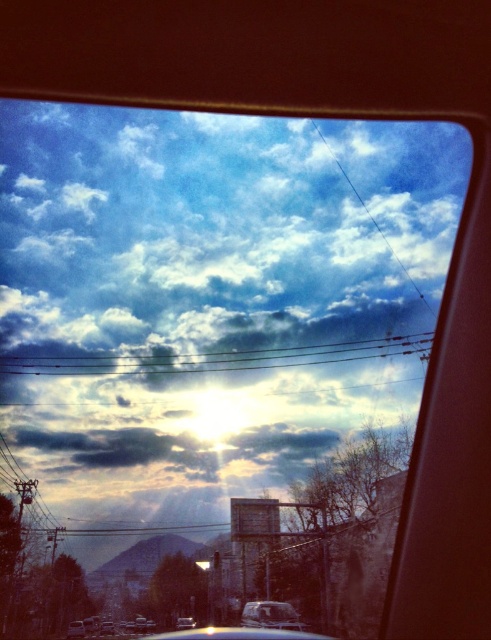
Which of these two, matte silver van at center or matte silver car at lower left, stands shorter?

matte silver car at lower left is shorter.

Who is positioned more to the left, matte silver van at center or matte silver car at lower left?

Positioned to the left is matte silver car at lower left.

Locate an element on the screen. matte silver van at center is located at coordinates (271, 616).